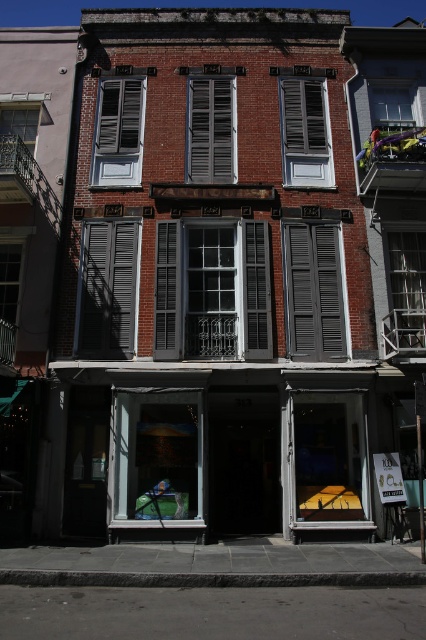
Which is in front, point (109, 269) or point (287, 106)?

Point (109, 269) is in front.

Who is more forward, (91, 323) or (325, 168)?

Point (91, 323) is in front.

You are a GUI agent. You are given a task and a screenshot of the screen. Output one action in this format:
    pyautogui.click(x=<x>, y=<y>)
    Task: Click on the matte gray shutter at center
    The image size is (426, 640).
    Given the screenshot: What is the action you would take?
    pyautogui.click(x=108, y=291)

Does clear glass window at center appear on the right side of black painted wood shutter at center?

In fact, clear glass window at center is to the left of black painted wood shutter at center.

The height and width of the screenshot is (640, 426). Describe the element at coordinates (213, 291) in the screenshot. I see `clear glass window at center` at that location.

Who is more distant from viewer, (250,294) or (261,305)?

Point (250,294)

The height and width of the screenshot is (640, 426). What are the coordinates of `clear glass window at center` in the screenshot? It's located at (213, 291).

Is black matte shutter at center below clear glass window at upper right?

Correct, black matte shutter at center is located below clear glass window at upper right.

Does black matte shutter at center have a greater width compared to clear glass window at upper right?

Incorrect, black matte shutter at center's width does not surpass clear glass window at upper right's.

You are a GUI agent. You are given a task and a screenshot of the screen. Output one action in this format:
    pyautogui.click(x=<x>, y=<y>)
    Task: Click on the black matte shutter at center
    
    Given the screenshot: What is the action you would take?
    pyautogui.click(x=166, y=291)